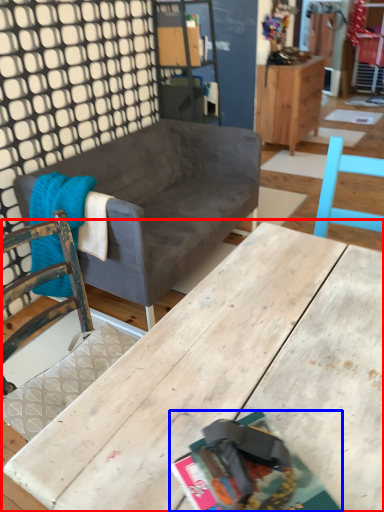
Question: Which of the following is the closest to the observer, table (highlighted by a red box) or magazine (highlighted by a blue box)?

Choices:
 (A) table
 (B) magazine

Answer: (A)